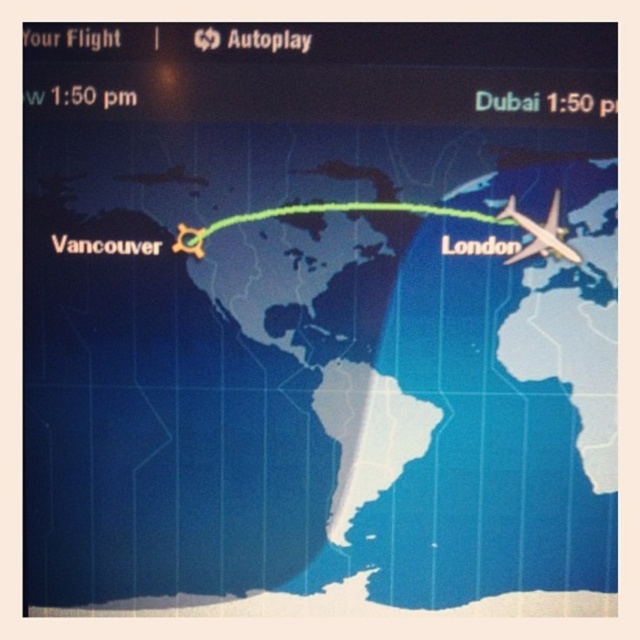
Question: Among these points, which one is nearest to the camera?

Choices:
 (A) (192, 230)
 (B) (176, 493)
 (C) (499, 218)

Answer: (C)

Question: Can you confirm if matte plastic map at center is wider than green line at center?

Choices:
 (A) no
 (B) yes

Answer: (B)

Question: Based on their relative distances, which object is farther from the matte plastic map at center?

Choices:
 (A) green line at center
 (B) metallic silver airplane at right

Answer: (B)

Question: Estimate the real-world distances between objects in this image. Which object is farther from the matte plastic map at center?

Choices:
 (A) green line at center
 (B) metallic silver airplane at right

Answer: (B)

Question: Can you confirm if matte plastic map at center is positioned below green line at center?

Choices:
 (A) no
 (B) yes

Answer: (B)

Question: Can you confirm if green line at center is wider than metallic silver airplane at right?

Choices:
 (A) no
 (B) yes

Answer: (B)